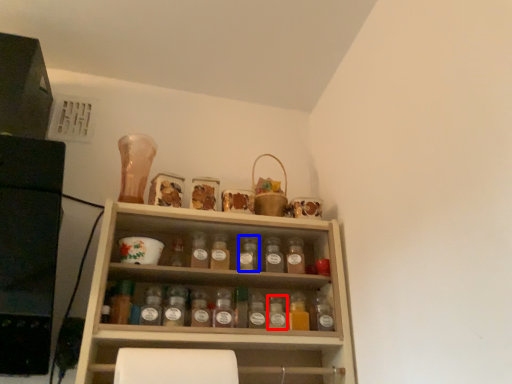
Question: Which of the following is the farthest to the observer, bottle (highlighted by a red box) or bottle (highlighted by a blue box)?

Choices:
 (A) bottle
 (B) bottle

Answer: (B)